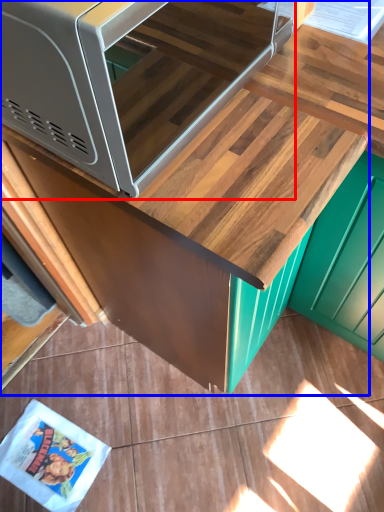
Question: Which of the following is the farthest to the observer, microwave (highlighted by a red box) or cabinetry (highlighted by a blue box)?

Choices:
 (A) microwave
 (B) cabinetry

Answer: (B)